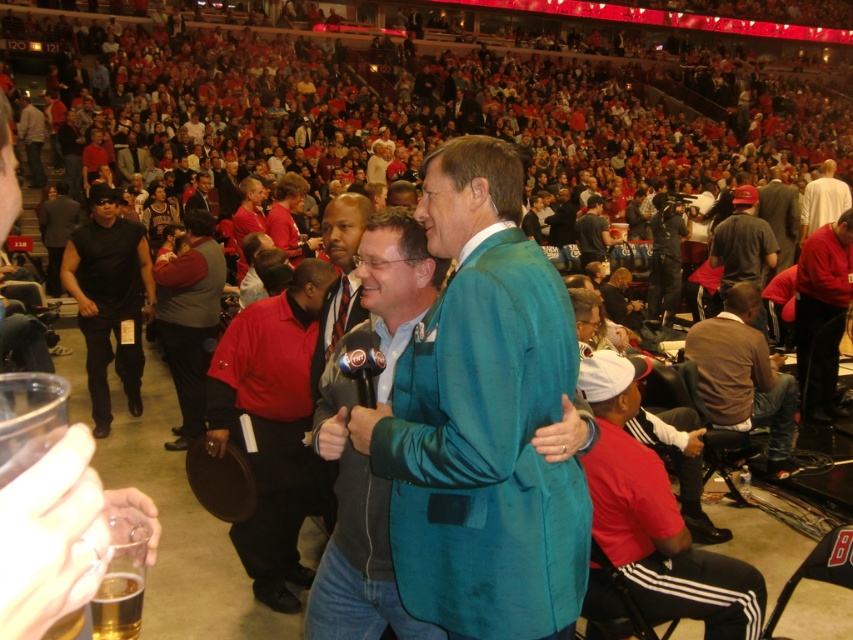
Does translucent glass at lower left lie behind teal leather jacket at center?

No, it is in front of teal leather jacket at center.

Is point (91, 618) positioned before point (577, 230)?

Yes, it is.

Image resolution: width=853 pixels, height=640 pixels. Identify the location of translucent glass at lower left. [x=117, y=605].

Between red smooth shirt at center and teal leather jacket at upper left, which one appears on the left side from the viewer's perspective?

teal leather jacket at upper left is more to the left.

Does red smooth shirt at center have a greater width compared to teal leather jacket at upper left?

No.

Is point (282, 467) positioned in front of point (42, 172)?

That is True.

You are a GUI agent. You are given a task and a screenshot of the screen. Output one action in this format:
    pyautogui.click(x=<x>, y=<y>)
    Task: Click on the red smooth shirt at center
    Image resolution: width=853 pixels, height=640 pixels.
    Given the screenshot: What is the action you would take?
    pyautogui.click(x=271, y=426)

Does gray fabric vest at center have a lesser height compared to metallic silver microphone at center?

In fact, gray fabric vest at center may be taller than metallic silver microphone at center.

Is gray fabric vest at center above metallic silver microphone at center?

Yes.

What do you see at coordinates (189, 317) in the screenshot? This screenshot has height=640, width=853. I see `gray fabric vest at center` at bounding box center [189, 317].

Find the location of `gray fabric vest at center`. gray fabric vest at center is located at coordinates (189, 317).